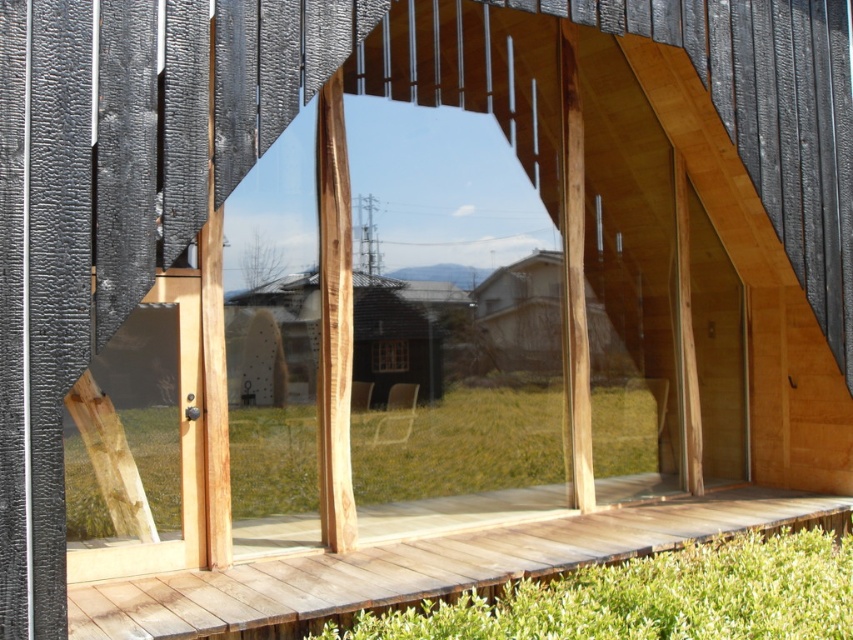
Question: Does transparent wood door at center come in front of transparent glass window at center?

Choices:
 (A) yes
 (B) no

Answer: (A)

Question: Which point is closer to the camera?

Choices:
 (A) (518, 285)
 (B) (390, 339)

Answer: (A)

Question: Considering the relative positions of transparent wood door at center and wooden house at center in the image provided, where is transparent wood door at center located with respect to wooden house at center?

Choices:
 (A) left
 (B) right

Answer: (A)

Question: Is wooden house at center bigger than transparent glass window at center?

Choices:
 (A) no
 (B) yes

Answer: (B)

Question: Which point is closer to the camera?

Choices:
 (A) transparent glass window at center
 (B) transparent wood door at center

Answer: (B)

Question: Which object is positioned farthest from the transparent wood door at center?

Choices:
 (A) transparent glass window at center
 (B) wooden house at center

Answer: (B)